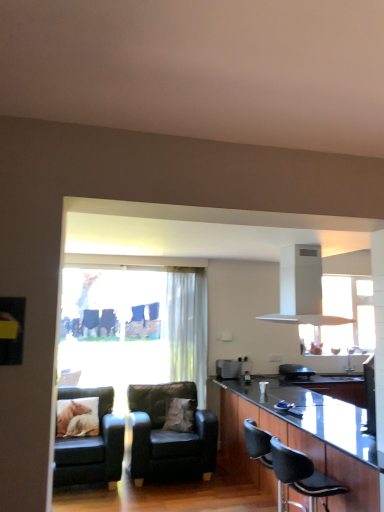
Question: Considering their positions, is black glossy countertop at center located in front of or behind white matte exhaust hood at upper center?

Choices:
 (A) behind
 (B) front

Answer: (B)

Question: Based on their sizes in the image, would you say black glossy countertop at center is bigger or smaller than white matte exhaust hood at upper center?

Choices:
 (A) small
 (B) big

Answer: (B)

Question: Which object is positioned closest to the black glossy countertop at center?

Choices:
 (A) white soft pillow at center, marked as the 2th pillow in a left-to-right arrangement
 (B) white matte exhaust hood at upper center
 (C) black leather chair at lower right, which is counted as the 1th chair, starting from the front
 (D) black leather chair at center, the 2th chair viewed from the left
 (E) translucent fabric curtain at center

Answer: (C)

Question: Which object is the closest to the leather couch at lower left, which ranks as the 2th chair in back-to-front order?

Choices:
 (A) black leather chair at lower right, the 3th chair positioned from the back
 (B) black leather armchair at lower center
 (C) translucent fabric curtain at center
 (D) white matte exhaust hood at upper center
 (E) white soft pillow at center, marked as the 2th pillow in a left-to-right arrangement

Answer: (E)